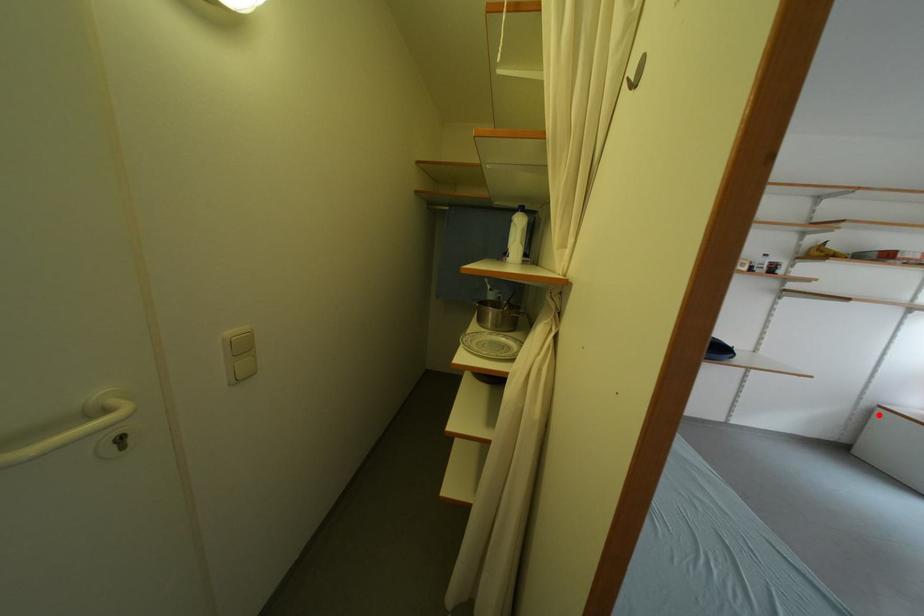
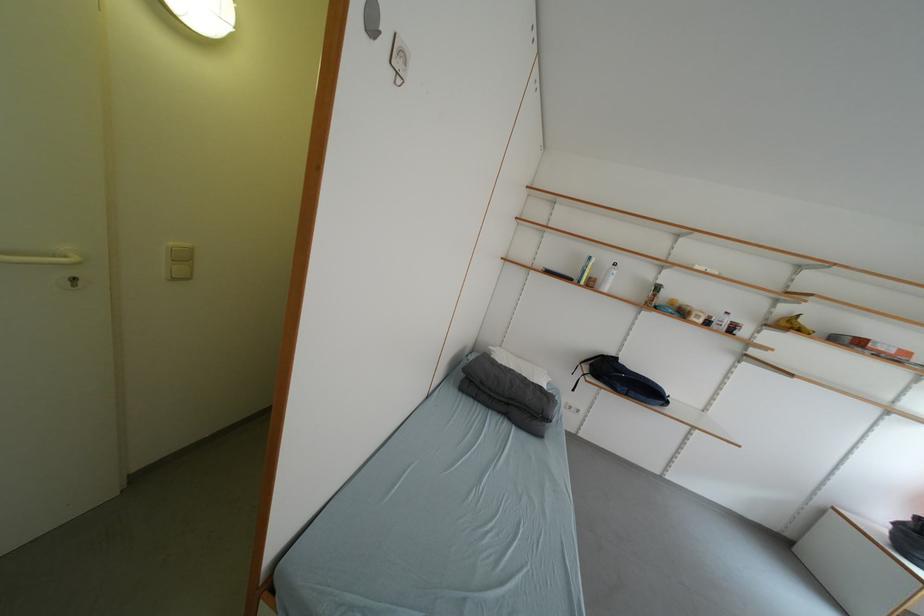
Locate, in the second image, the point that corresponds to the highlighted location in the first image.

(832, 515)